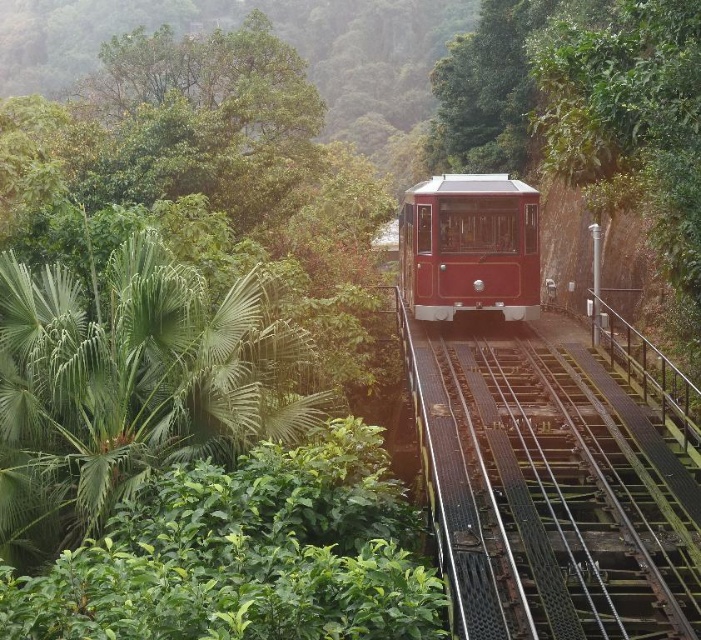
Question: Where is black metal train track at center located in relation to shiny red tram at center in the image?

Choices:
 (A) below
 (B) above

Answer: (A)

Question: Can you confirm if black metal train track at center is smaller than shiny red tram at center?

Choices:
 (A) no
 (B) yes

Answer: (B)

Question: Which object appears closest to the camera in this image?

Choices:
 (A) black metal train track at center
 (B) shiny red tram at center

Answer: (A)

Question: Which point appears closest to the camera in this image?

Choices:
 (A) (494, 390)
 (B) (454, 253)

Answer: (A)

Question: Which of the following is the closest to the observer?

Choices:
 (A) black metal train track at center
 (B) shiny red tram at center

Answer: (A)

Question: Is black metal train track at center to the left of shiny red tram at center from the viewer's perspective?

Choices:
 (A) yes
 (B) no

Answer: (B)